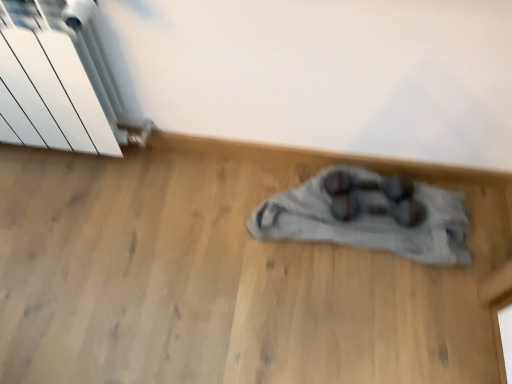
Locate an element on the screen. This screenshot has width=512, height=384. free space behind shiny black dumbbells at center is located at coordinates tap(361, 172).